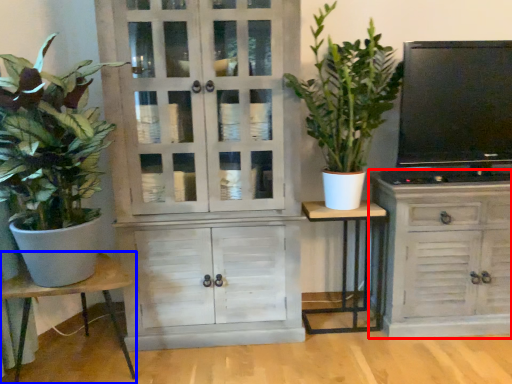
Question: Which object is closer to the camera taking this photo, cabinetry (highlighted by a red box) or table (highlighted by a blue box)?

Choices:
 (A) cabinetry
 (B) table

Answer: (B)